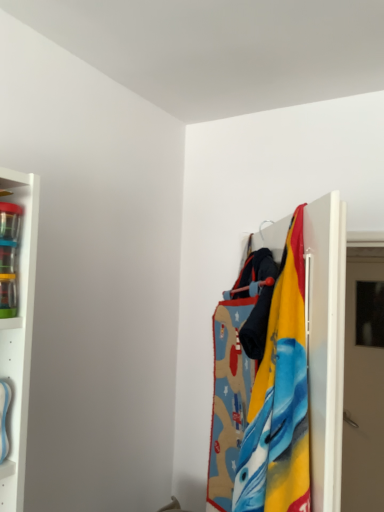
Question: Is the depth of textured fabric at right greater than that of beige matte door at right?

Choices:
 (A) no
 (B) yes

Answer: (A)

Question: Is textured fabric at right positioned far away from beige matte door at right?

Choices:
 (A) no
 (B) yes

Answer: (B)

Question: Can you confirm if textured fabric at right is shorter than beige matte door at right?

Choices:
 (A) yes
 (B) no

Answer: (A)

Question: Is beige matte door at right inside textured fabric at right?

Choices:
 (A) no
 (B) yes

Answer: (A)

Question: From the image's perspective, is textured fabric at right on top of beige matte door at right?

Choices:
 (A) yes
 (B) no

Answer: (A)

Question: Is textured fabric at right directly adjacent to beige matte door at right?

Choices:
 (A) yes
 (B) no

Answer: (B)

Question: Are beige matte door at right and textured fabric at right far apart?

Choices:
 (A) no
 (B) yes

Answer: (B)

Question: Is beige matte door at right facing away from textured fabric at right?

Choices:
 (A) yes
 (B) no

Answer: (B)

Question: From a real-world perspective, is beige matte door at right under textured fabric at right?

Choices:
 (A) yes
 (B) no

Answer: (A)

Question: Is beige matte door at right oriented towards textured fabric at right?

Choices:
 (A) no
 (B) yes

Answer: (B)

Question: Considering the relative sizes of beige matte door at right and textured fabric at right in the image provided, is beige matte door at right thinner than textured fabric at right?

Choices:
 (A) yes
 (B) no

Answer: (A)

Question: From a real-world perspective, is beige matte door at right located higher than textured fabric at right?

Choices:
 (A) yes
 (B) no

Answer: (B)

Question: From the image's perspective, is beige matte door at right above or below textured fabric at right?

Choices:
 (A) below
 (B) above

Answer: (A)